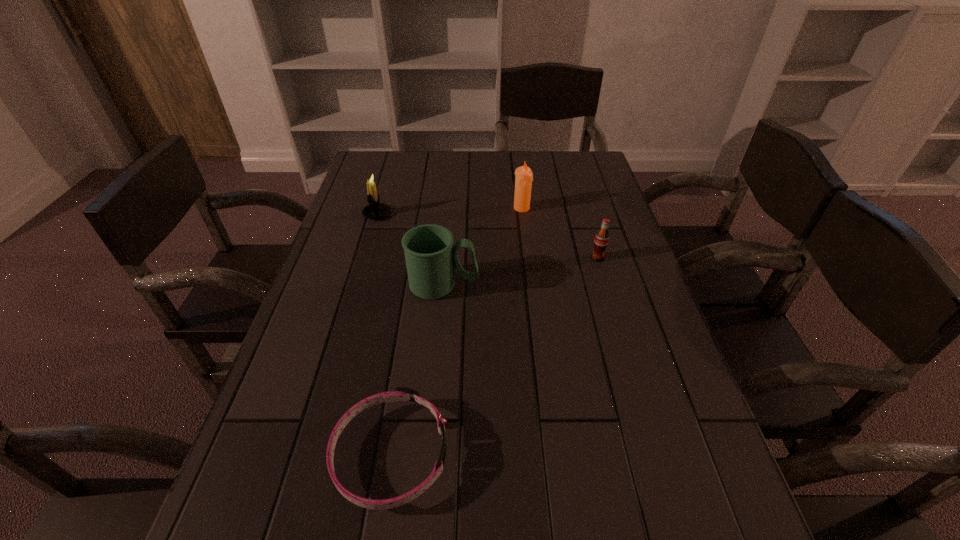
Locate an element on the screen. The image size is (960, 540). free space located 0.170m on the front of the third nearest object is located at coordinates (612, 308).

Image resolution: width=960 pixels, height=540 pixels. Identify the location of vacant position located 0.270m with the buckle on the dog collar. (595, 454).

In order to click on candle holder located in the left edge section of the desktop in this screenshot , I will do `click(375, 210)`.

The image size is (960, 540). What are the coordinates of `dog collar at the left edge` in the screenshot? It's located at (400, 394).

Locate an element on the screen. The height and width of the screenshot is (540, 960). object that is positioned at the right edge is located at coordinates (601, 240).

In the image, there is a desktop. At what (x,y) coordinates should I click in order to perform the action: click on vacant space at the left edge. Please return your answer as a coordinate pair (x, y). Image resolution: width=960 pixels, height=540 pixels. Looking at the image, I should click on (297, 387).

Locate an element on the screen. Image resolution: width=960 pixels, height=540 pixels. vacant space at the right edge is located at coordinates (643, 429).

Find the location of a particular element. Image resolution: width=960 pixels, height=540 pixels. vacant region at the far left corner is located at coordinates (362, 171).

In the image, there is a desktop. At what (x,y) coordinates should I click in order to perform the action: click on free space at the far right corner. Please return your answer as a coordinate pair (x, y). Looking at the image, I should click on pyautogui.click(x=560, y=173).

You are a GUI agent. You are given a task and a screenshot of the screen. Output one action in this format:
    pyautogui.click(x=<x>, y=<y>)
    Task: Click on the vacant space in between the dog collar and the candle
    Image resolution: width=960 pixels, height=540 pixels.
    Given the screenshot: What is the action you would take?
    pyautogui.click(x=456, y=331)